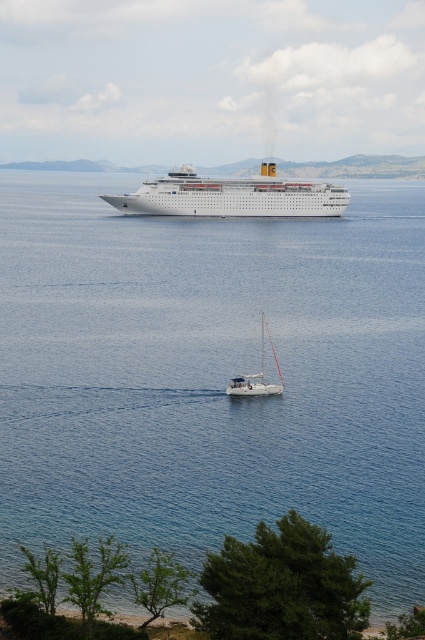
Question: Which object is closer to the camera taking this photo?

Choices:
 (A) white glossy cruise ship at center
 (B) white matte sailboat at center

Answer: (B)

Question: Does clear blue water at center come behind white glossy cruise ship at center?

Choices:
 (A) no
 (B) yes

Answer: (A)

Question: Is clear blue water at center bigger than white matte sailboat at center?

Choices:
 (A) yes
 (B) no

Answer: (A)

Question: Estimate the real-world distances between objects in this image. Which object is farther from the clear blue water at center?

Choices:
 (A) white matte sailboat at center
 (B) white glossy cruise ship at center

Answer: (A)

Question: Which point is farther to the camera?

Choices:
 (A) white glossy cruise ship at center
 (B) white matte sailboat at center
 (C) clear blue water at center

Answer: (A)

Question: Does white glossy cruise ship at center have a smaller size compared to white matte sailboat at center?

Choices:
 (A) no
 (B) yes

Answer: (A)